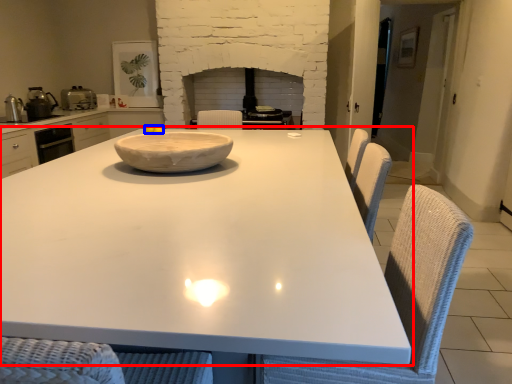
Question: Which object appears farthest to the camera in this image, table (highlighted by a red box) or food (highlighted by a blue box)?

Choices:
 (A) table
 (B) food

Answer: (B)